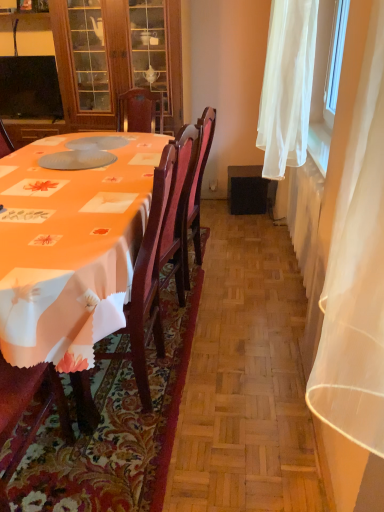
Image resolution: width=384 pixels, height=512 pixels. I want to click on vacant space in front of wooden chair at left, so click(x=121, y=455).